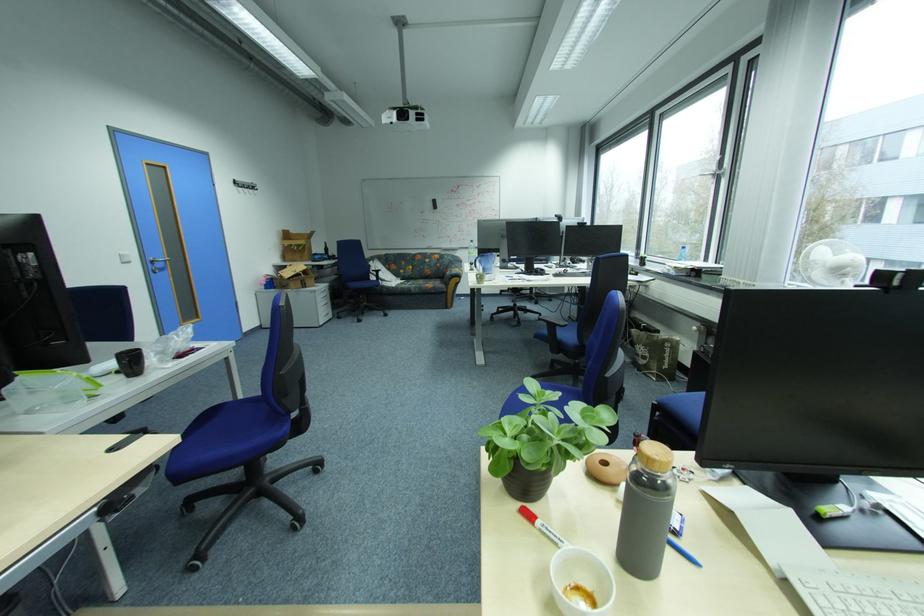
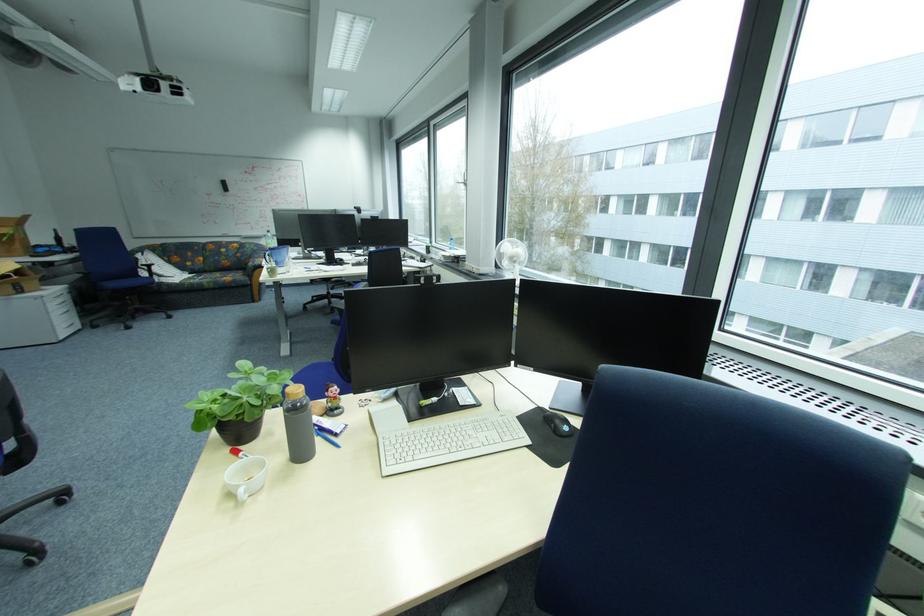
In the second image, find the point that corresponds to (x=464, y=268) in the first image.

(268, 257)